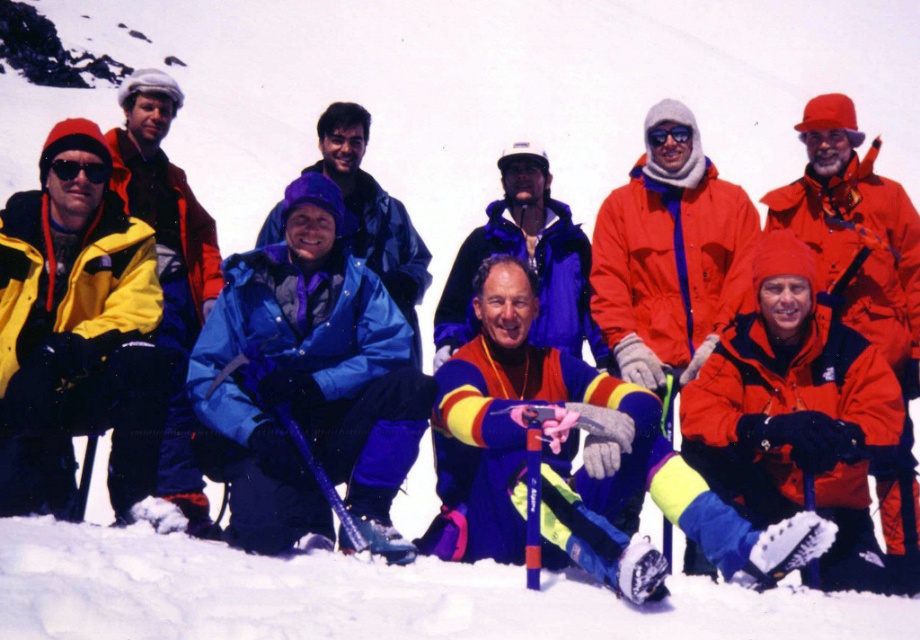
Question: Does yellow and purple snow pants at lower center lie behind matte blue jacket at center?

Choices:
 (A) yes
 (B) no

Answer: (B)

Question: Estimate the real-world distances between objects in this image. Which object is closer to the orange waterproof jacket at center?

Choices:
 (A) blue matte jacket at center
 (B) blue shiny jacket at center

Answer: (B)

Question: Which object is positioned closest to the blue shiny jacket at center?

Choices:
 (A) blue matte jacket at center
 (B) matte yellow jacket at left

Answer: (B)

Question: Is blue shiny jacket at center above orange waterproof jacket at center?

Choices:
 (A) yes
 (B) no

Answer: (B)

Question: Estimate the real-world distances between objects in this image. Which object is farther from the matte black jacket at left?

Choices:
 (A) orange waterproof jacket at center
 (B) yellow and purple snow pants at lower center
 (C) blue shiny jacket at center

Answer: (A)

Question: Can you confirm if yellow and purple snow pants at lower center is positioned below orange waterproof jacket at center?

Choices:
 (A) yes
 (B) no

Answer: (A)